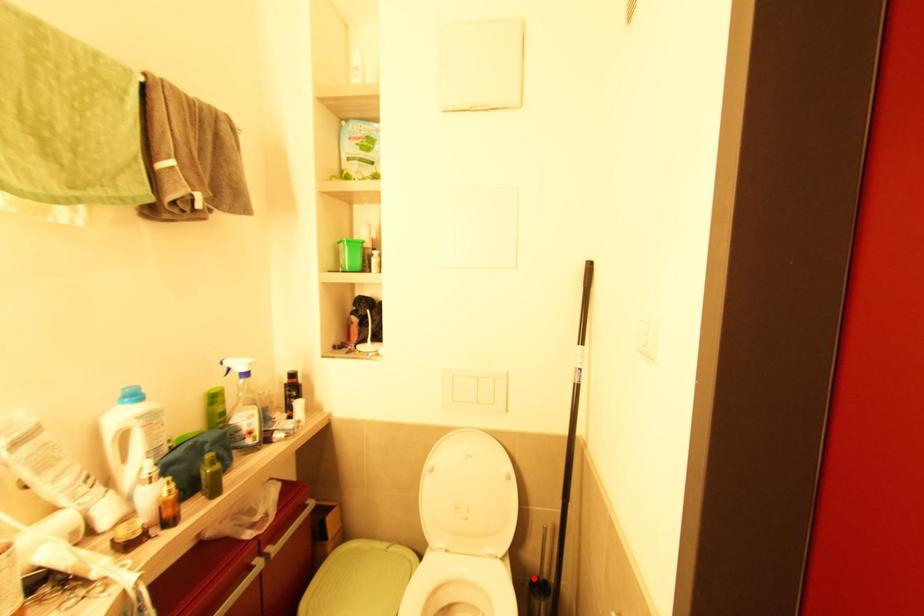
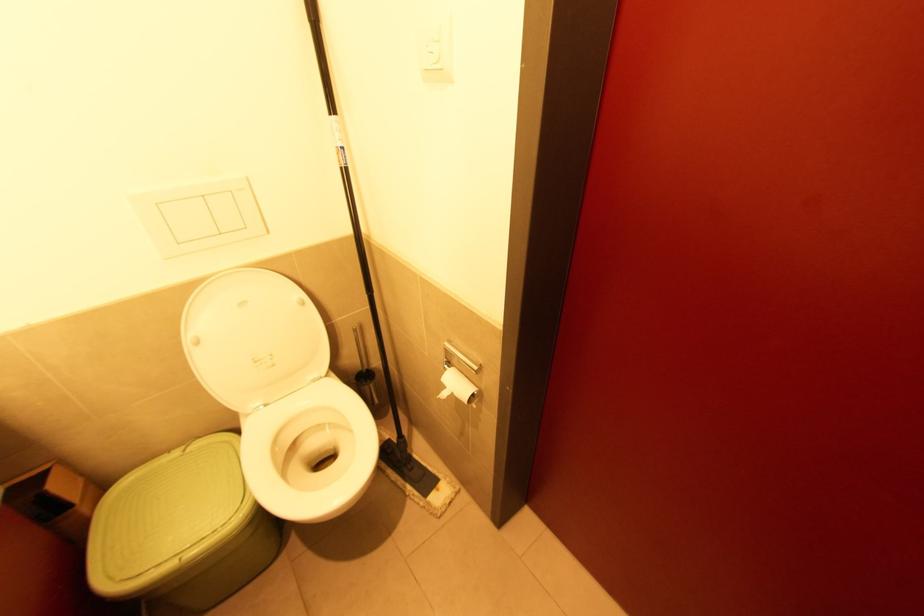
In the second image, find the point that corresponds to the highlighted location in the first image.

(358, 374)